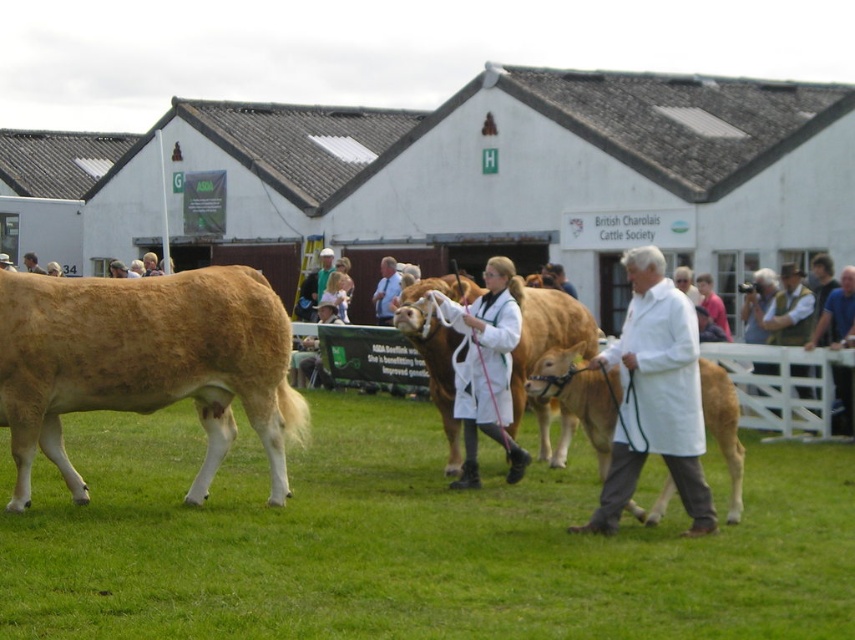
You are a photographer standing at the edge of the field. You want to take a photo that includes both the white lab coat at center and the golden brown cow at center. Given that your camera has a maximum focus range of 3 meters, will you be able to capture both subjects in focus?

The white lab coat at center and golden brown cow at center are 3.16 meters apart. Since the distance between them exceeds the camera maximum focus range of 3 meters, you won that be able to capture both subjects in focus.

You are a photographer at the cattle show. You want to take a photo of the golden brown leather cow at center and the light brown leather jacket at center. Based on their positions, which one should you focus on first to ensure both are in frame?

The golden brown leather cow at center is below the light brown leather jacket at center, so you should focus on the light brown leather jacket at center first to ensure both are in frame.